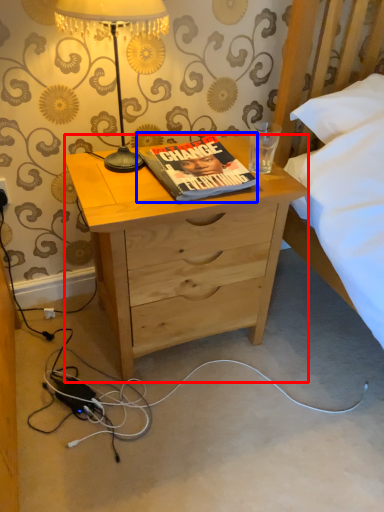
Question: Among these objects, which one is nearest to the camera, desk (highlighted by a red box) or book (highlighted by a blue box)?

Choices:
 (A) desk
 (B) book

Answer: (A)